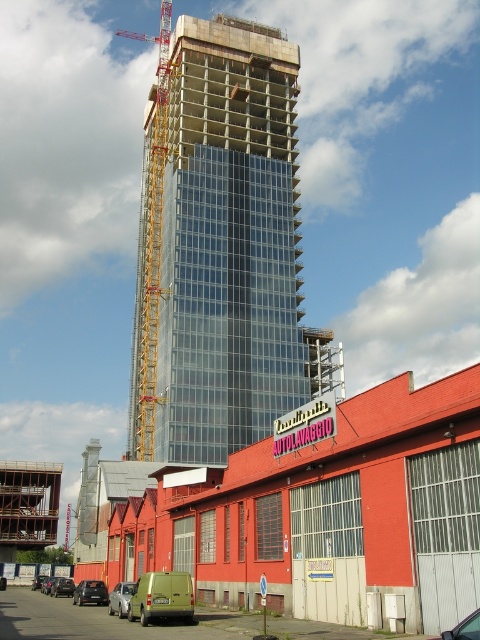
You are a delivery driver who needs to park your vehicle in a tight space between the metallic green van at lower left and the shiny silver car at lower left. Your delivery truck is 2 meters tall. Can you safely park here without hitting the vehicles?

The metallic green van at lower left is not as tall as the shiny silver car at lower left. Since the van is shorter, the height of the space between them depends on the taller vehicle, which is the shiny silver car. If the car is taller than 2 meters, the truck can park safely. However, without knowing the exact height of the car, it is uncertain. The information provided does not specify the actual heights, so it is safer to assume the space might be insufficient.

You are a delivery driver arriving at the urban scene. You need to park your vehicle between the metallic green van at lower left and the shiny silver car at lower left. Is there enough space for your vehicle which is 5 meters long?

The metallic green van at lower left is to the right of the shiny silver car at lower left, so there is no space between them for your vehicle. You cannot park between them.

You are a delivery driver trying to park your truck between the shiny silver car at lower left and the black matte car at lower left. Can you fit your truck that is 2 meters wide into the space between them?

The shiny silver car at lower left is in front of the black matte car at lower left, so there is no space between them for the truck to park.